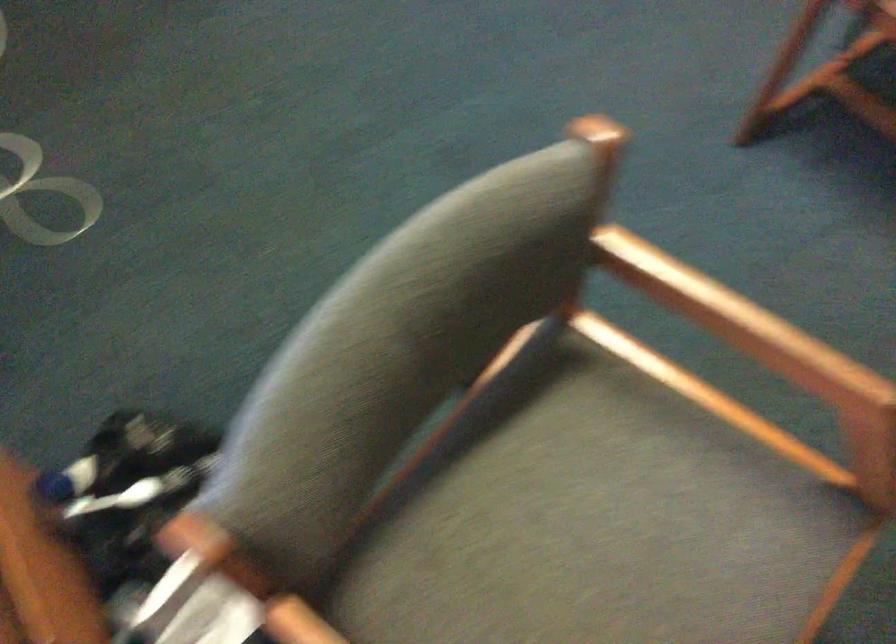
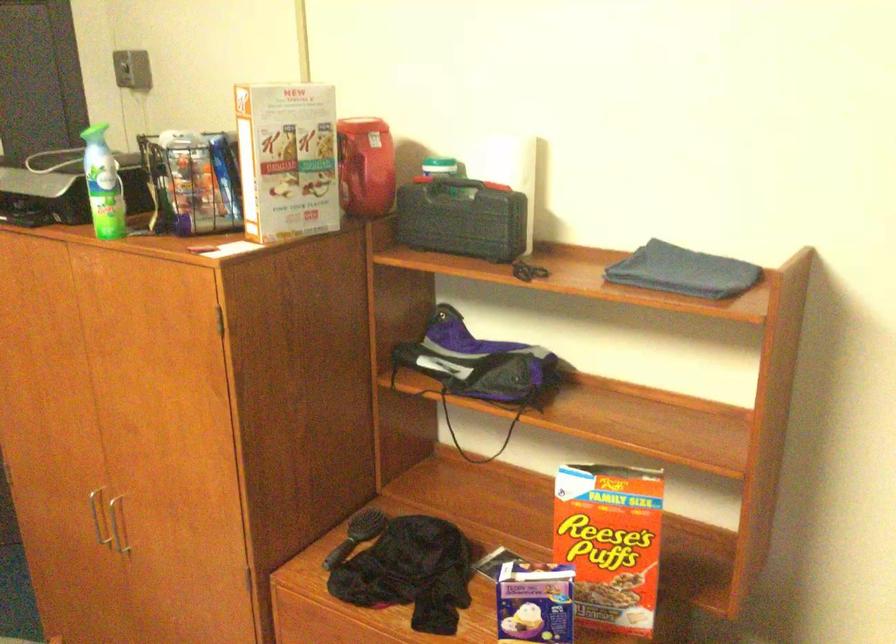
Question: How did the camera likely rotate?

Choices:
 (A) Left
 (B) Right
 (C) Up
 (D) Down

Answer: (B)